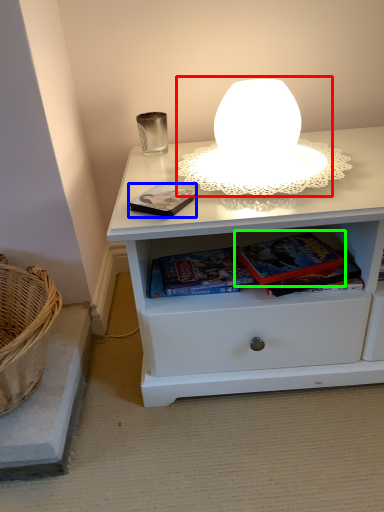
Question: Which object is positioned farthest from table lamp (highlighted by a red box)? Select from paperback book (highlighted by a blue box) and paperback book (highlighted by a green box).

Choices:
 (A) paperback book
 (B) paperback book

Answer: (B)